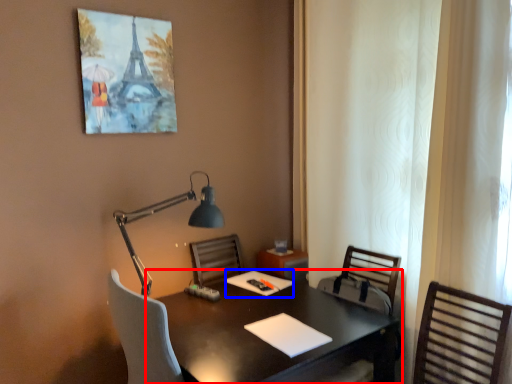
Question: Which point is further to the camera, desk (highlighted by a red box) or notepad (highlighted by a blue box)?

Choices:
 (A) desk
 (B) notepad

Answer: (B)